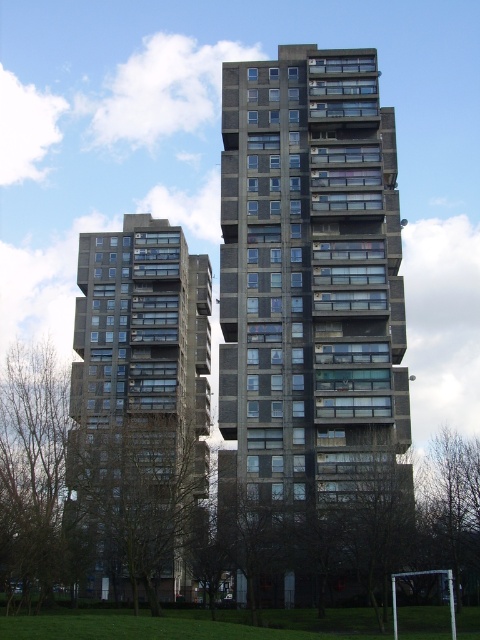
Measure the distance between point (236, 200) and camera.

A distance of 92.87 meters exists between point (236, 200) and camera.

Who is shorter, concrete block building at center or dark gray concrete building at left?

Standing shorter between the two is dark gray concrete building at left.

Who is more distant from viewer, (263,156) or (107,243)?

Point (107,243)

Where is `concrete block building at center`? The width and height of the screenshot is (480, 640). concrete block building at center is located at coordinates (310, 276).